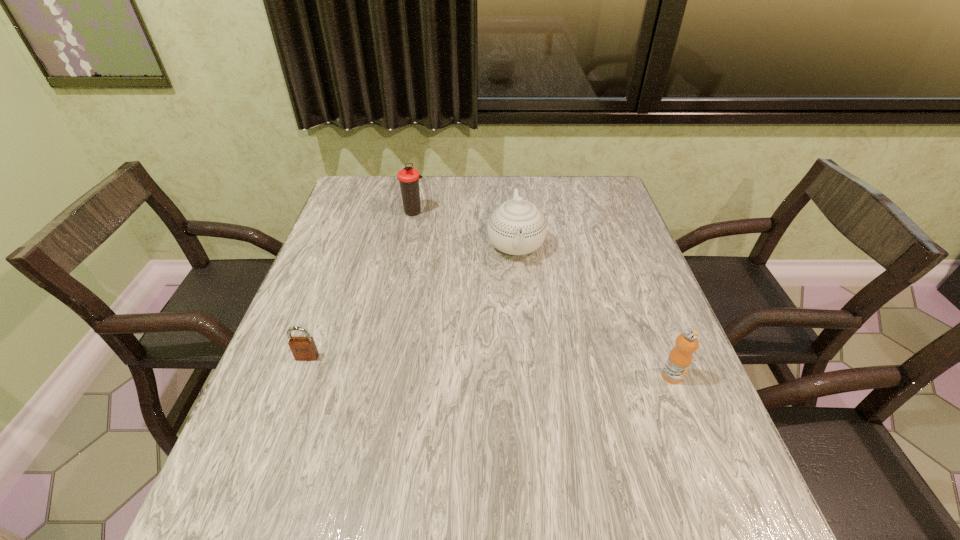
Where is `thermos bottle`? The height and width of the screenshot is (540, 960). thermos bottle is located at coordinates (408, 177).

This screenshot has height=540, width=960. I want to click on the farthest object, so click(408, 177).

Find the location of a particular element. The width and height of the screenshot is (960, 540). the third nearest object is located at coordinates (517, 227).

Find the location of a particular element. Image resolution: width=960 pixels, height=540 pixels. chinaware is located at coordinates 517,227.

Where is `orange juice`? This screenshot has height=540, width=960. orange juice is located at coordinates (679, 360).

Locate an element on the screen. the rightmost object is located at coordinates (679, 360).

Find the location of a particular element. This screenshot has width=960, height=540. padlock is located at coordinates (303, 348).

At what (x,y) coordinates should I click in order to perform the action: click on the leftmost object. Please return your answer as a coordinate pair (x, y). Looking at the image, I should click on (303, 348).

This screenshot has width=960, height=540. I want to click on vacant space located on the back of the farthest object, so click(x=420, y=178).

Where is `blank space located on the spout of the third object from left to right`? blank space located on the spout of the third object from left to right is located at coordinates (519, 284).